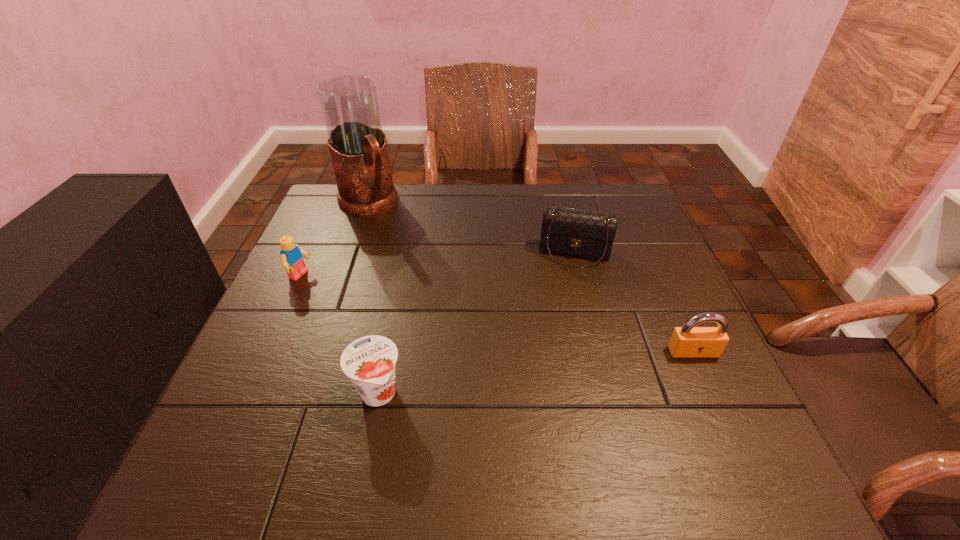
Image resolution: width=960 pixels, height=540 pixels. What are the coordinates of `free space on the desktop that is between the third object from left to right and the padlock and is positioned with the handle on the side of the pitcher` in the screenshot? It's located at (513, 376).

You are a GUI agent. You are given a task and a screenshot of the screen. Output one action in this format:
    pyautogui.click(x=<x>, y=<y>)
    Task: Click on the free space on the desktop that is between the third object from right to left and the padlock and is positioned on the front flap of the clutch bag
    
    Given the screenshot: What is the action you would take?
    tap(562, 369)

Locate an element on the screen. free spot on the desktop that is between the yogurt and the rightmost object and is positioned on the front-facing side of the Lego is located at coordinates tap(555, 370).